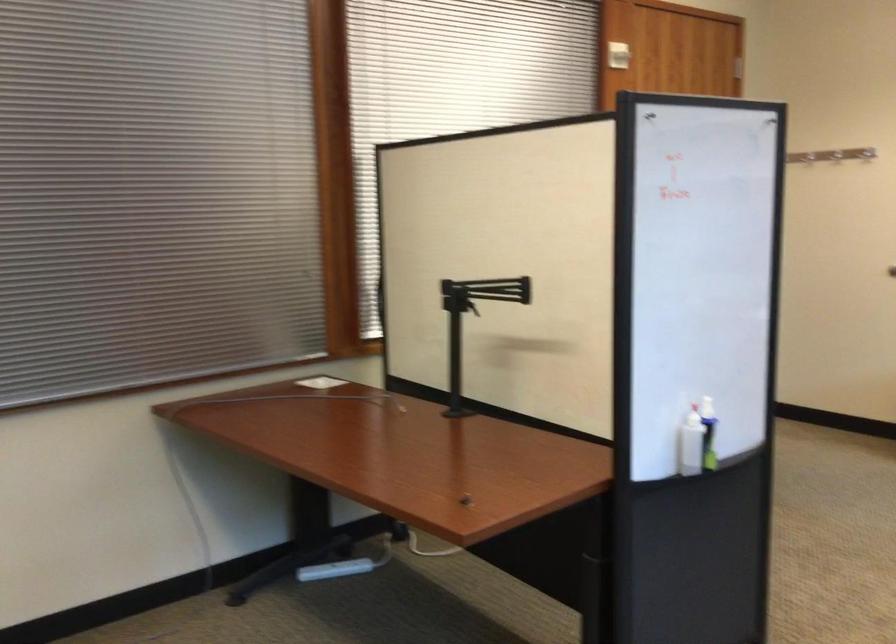
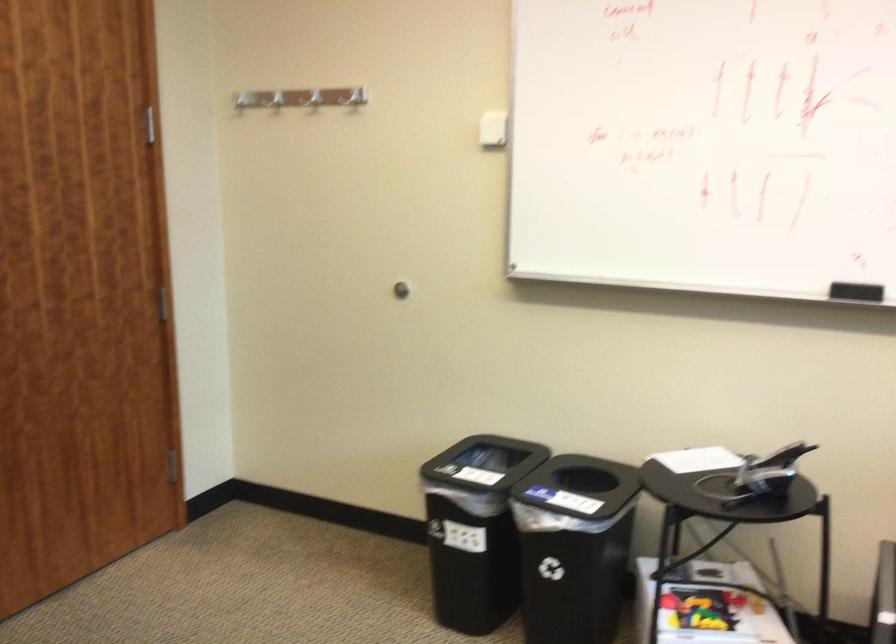
The images are taken continuously from a first-person perspective. In which direction are you moving?

The cameraman walked toward right, forward.